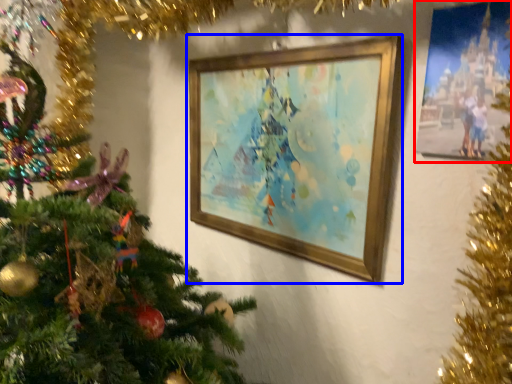
Question: Which of the following is the farthest to the observer, picture frame (highlighted by a red box) or picture frame (highlighted by a blue box)?

Choices:
 (A) picture frame
 (B) picture frame

Answer: (B)